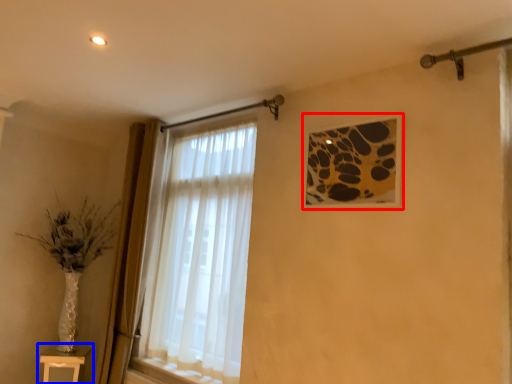
Question: Which point is closer to the camera, picture frame (highlighted by a red box) or table (highlighted by a blue box)?

Choices:
 (A) picture frame
 (B) table

Answer: (A)